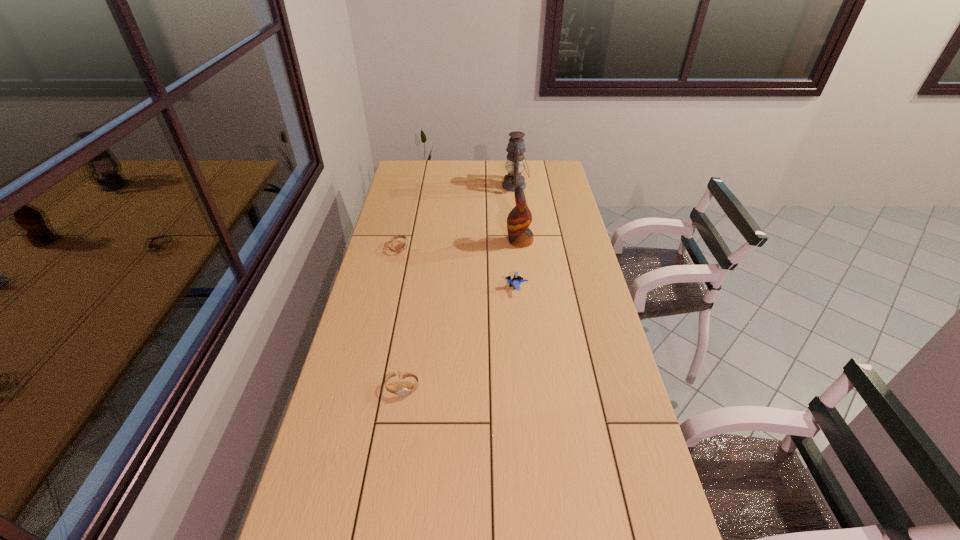
I want to click on vacant space at the far left corner of the desktop, so click(x=412, y=181).

Locate an element on the screen. This screenshot has height=540, width=960. vacant space at the far right corner of the desktop is located at coordinates (540, 170).

The image size is (960, 540). Find the location of `vacant space that is in between the oil lamp and the leftmost object`. vacant space that is in between the oil lamp and the leftmost object is located at coordinates (457, 217).

Find the location of `vacant space in between the right watch and the left watch`. vacant space in between the right watch and the left watch is located at coordinates click(x=401, y=318).

The width and height of the screenshot is (960, 540). Find the location of `blank region between the parrot and the left watch`. blank region between the parrot and the left watch is located at coordinates (460, 245).

Where is `vacant space in between the Lego and the right watch`? The height and width of the screenshot is (540, 960). vacant space in between the Lego and the right watch is located at coordinates (460, 338).

Where is `free space that is in between the parrot and the fourth farthest object`? The height and width of the screenshot is (540, 960). free space that is in between the parrot and the fourth farthest object is located at coordinates (518, 264).

Locate an element on the screen. free space between the Lego and the parrot is located at coordinates (518, 264).

In order to click on vacant point located between the parrot and the Lego in this screenshot , I will do `click(518, 264)`.

This screenshot has width=960, height=540. What are the coordinates of `blank region between the farthest object and the leftmost object` in the screenshot? It's located at (457, 217).